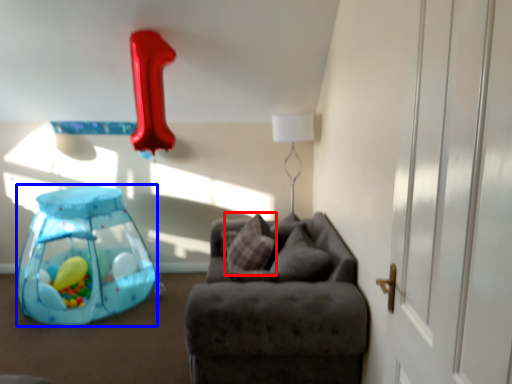
Question: Which object is closer to the camera taking this photo, pillow (highlighted by a red box) or toy (highlighted by a blue box)?

Choices:
 (A) pillow
 (B) toy

Answer: (A)